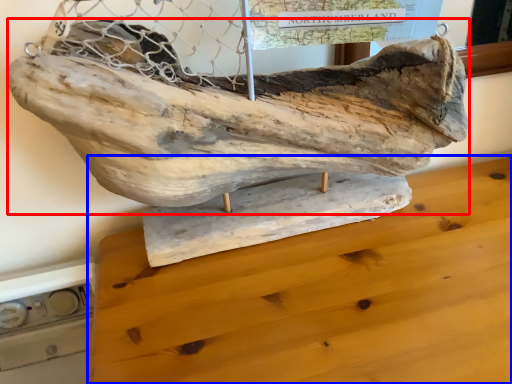
Question: Which of the following is the farthest to the observer, sculpture (highlighted by a red box) or furniture (highlighted by a blue box)?

Choices:
 (A) sculpture
 (B) furniture

Answer: (A)